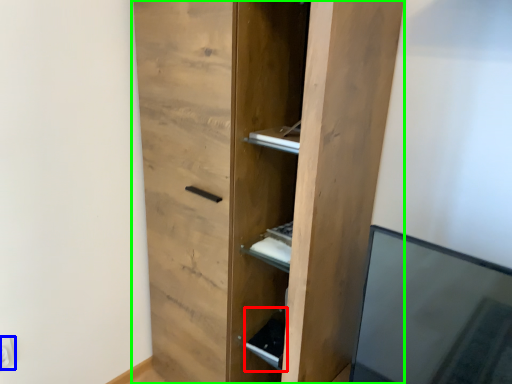
Question: Based on their relative distances, which object is nearer to cabinet (highlighted by a red box)? Choose from electric outlet (highlighted by a blue box) and cupboard (highlighted by a green box).

Choices:
 (A) electric outlet
 (B) cupboard

Answer: (B)